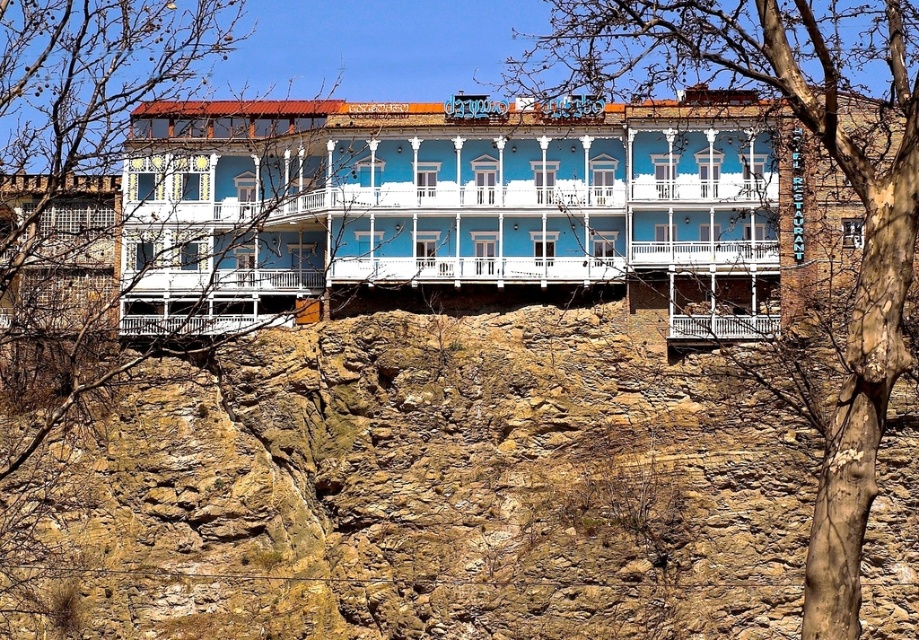
Does brown rocky hillside at center lie in front of bare bark tree at center?

No, brown rocky hillside at center is behind bare bark tree at center.

Based on the photo, which is more to the left, brown rocky hillside at center or bare bark tree at center?

brown rocky hillside at center

What are the coordinates of `brown rocky hillside at center` in the screenshot? It's located at (434, 490).

Find the location of a particular element. brown rocky hillside at center is located at coordinates 434,490.

Is brown rocky hillside at center to the left of bare branches at upper left from the viewer's perspective?

No, brown rocky hillside at center is not to the left of bare branches at upper left.

Does brown rocky hillside at center have a lesser height compared to bare branches at upper left?

Indeed, brown rocky hillside at center has a lesser height compared to bare branches at upper left.

This screenshot has height=640, width=919. What do you see at coordinates (434, 490) in the screenshot?
I see `brown rocky hillside at center` at bounding box center [434, 490].

You are a GUI agent. You are given a task and a screenshot of the screen. Output one action in this format:
    pyautogui.click(x=<x>, y=<y>)
    Task: Click on the brown rocky hillside at center
    Image resolution: width=919 pixels, height=640 pixels.
    Given the screenshot: What is the action you would take?
    [434, 490]

Is bare branches at upper left below bare bark tree at center?

Indeed, bare branches at upper left is positioned under bare bark tree at center.

Is bare branches at upper left to the left of bare bark tree at center from the viewer's perspective?

Correct, you'll find bare branches at upper left to the left of bare bark tree at center.

At what (x,y) coordinates should I click in order to perform the action: click on bare branches at upper left. Please return your answer as a coordinate pair (x, y). This screenshot has width=919, height=640. Looking at the image, I should click on (72, 256).

Locate an element on the screen. Image resolution: width=919 pixels, height=640 pixels. bare branches at upper left is located at coordinates (72, 256).